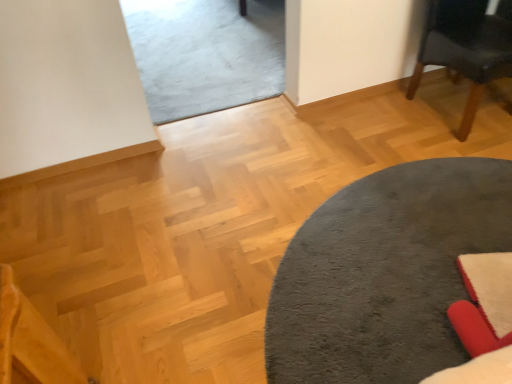
Find the location of a particular element. This screenshot has width=512, height=384. vacant area that lies in front of dark gray fabric chair at upper right is located at coordinates (459, 176).